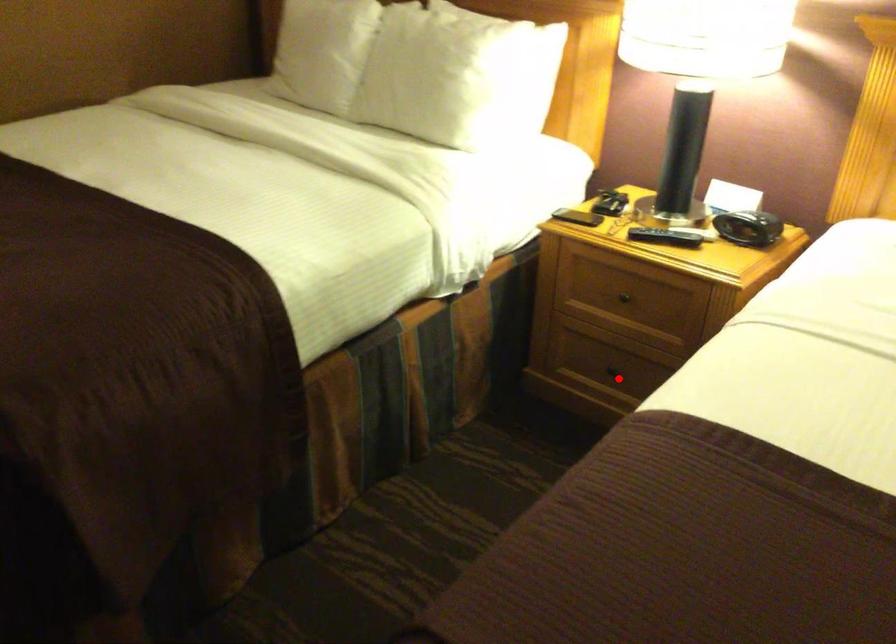
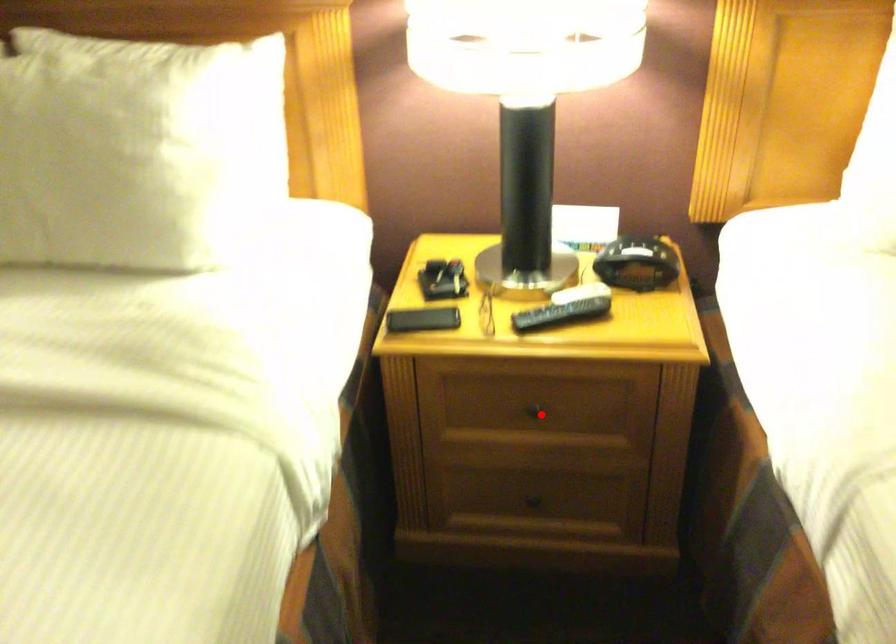
I am providing you with two images of the same scene from different viewpoints. A red point is marked on the first image and another point is marked on the second image. Are the points marked in image1 and image2 representing the same 3D position?

No